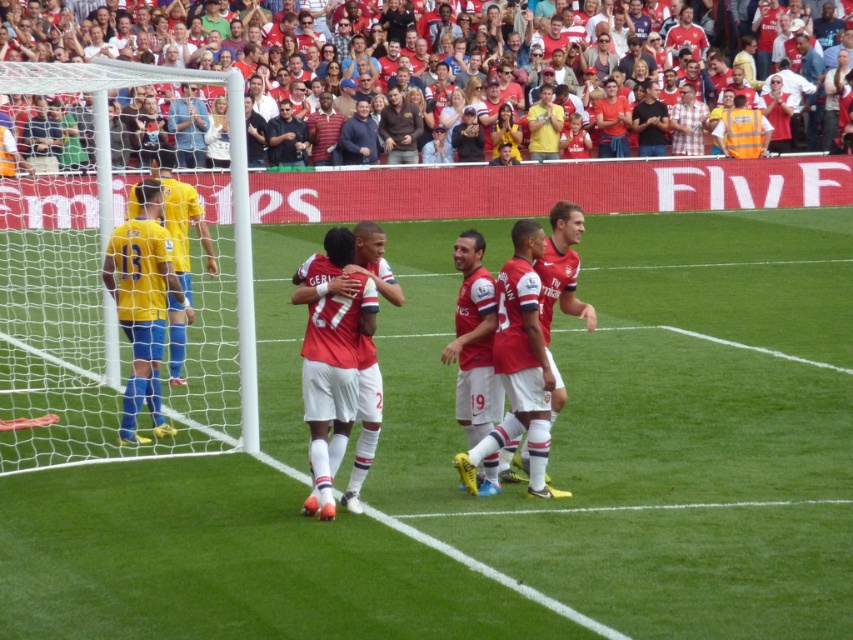
Question: Among these points, which one is farthest from the camera?

Choices:
 (A) (189, 276)
 (B) (366, 115)
 (C) (412, 118)

Answer: (C)

Question: Which of these objects is positioned farthest from the dark brown leather jacket at upper center?

Choices:
 (A) green grass at center
 (B) brown cotton shirt at center
 (C) white mesh net at left

Answer: (A)

Question: Among these points, which one is farthest from the camera?

Choices:
 (A) (637, 300)
 (B) (397, 92)
 (C) (346, 163)

Answer: (B)

Question: Is matte red jersey at center smaller than brown cotton shirt at center?

Choices:
 (A) yes
 (B) no

Answer: (A)

Question: Does green grass at center have a lesser width compared to dark brown leather jacket at upper center?

Choices:
 (A) no
 (B) yes

Answer: (A)

Question: Can you confirm if brown cotton shirt at center is positioned to the right of dark blue sweater at upper center?

Choices:
 (A) yes
 (B) no

Answer: (A)